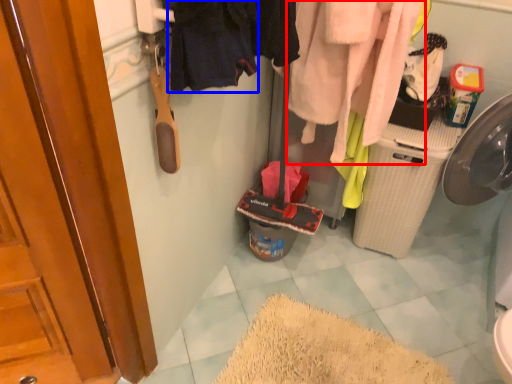
Question: Which point is closer to the camera, clothing (highlighted by a red box) or clothing (highlighted by a blue box)?

Choices:
 (A) clothing
 (B) clothing

Answer: (B)